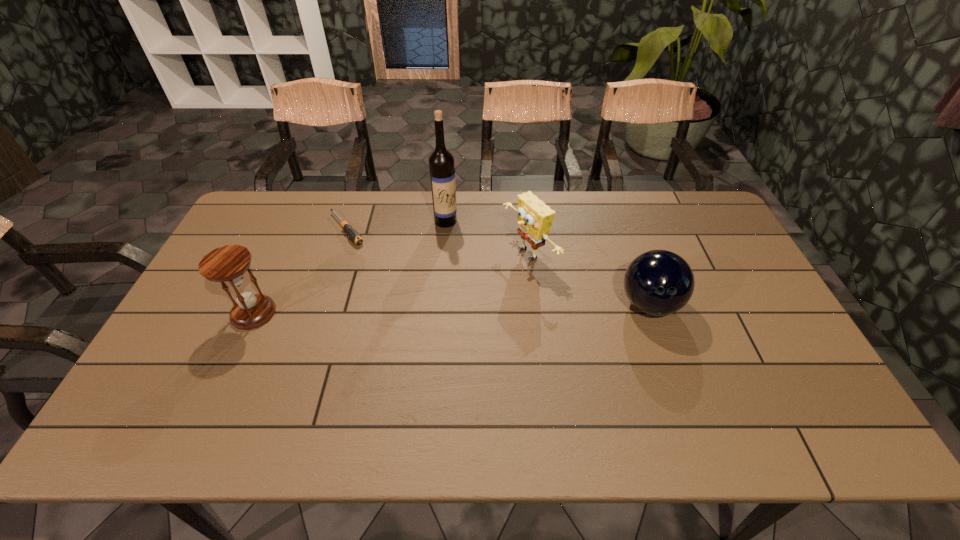
I want to click on free spot located on the label of the third object from left to right, so click(480, 303).

This screenshot has width=960, height=540. What are the coordinates of `vacant space located 0.200m on the label of the third object from left to right` in the screenshot? It's located at (465, 267).

At what (x,y) coordinates should I click in order to perform the action: click on free space located at the tip of the screwdriver. Please return your answer as a coordinate pair (x, y). Looking at the image, I should click on (366, 255).

Locate an element on the screen. free point located 0.310m at the tip of the screwdriver is located at coordinates (404, 301).

What are the coordinates of `vacant space situated at the tip of the screwdriver` in the screenshot? It's located at (364, 254).

This screenshot has height=540, width=960. I want to click on vacant area situated 0.290m on the face of the sponge, so click(423, 308).

Find the location of a particular element. This screenshot has height=540, width=960. free space located on the face of the sponge is located at coordinates (445, 298).

You are a GUI agent. You are given a task and a screenshot of the screen. Output one action in this format:
    pyautogui.click(x=<x>, y=<y>)
    Task: Click on the vacant region located on the face of the sponge
    This screenshot has height=540, width=960.
    Given the screenshot: What is the action you would take?
    pyautogui.click(x=397, y=320)

Where is `wine bottle at the far edge`? This screenshot has height=540, width=960. wine bottle at the far edge is located at coordinates (441, 162).

Image resolution: width=960 pixels, height=540 pixels. In order to click on screwdriver present at the far edge in this screenshot , I will do `click(352, 233)`.